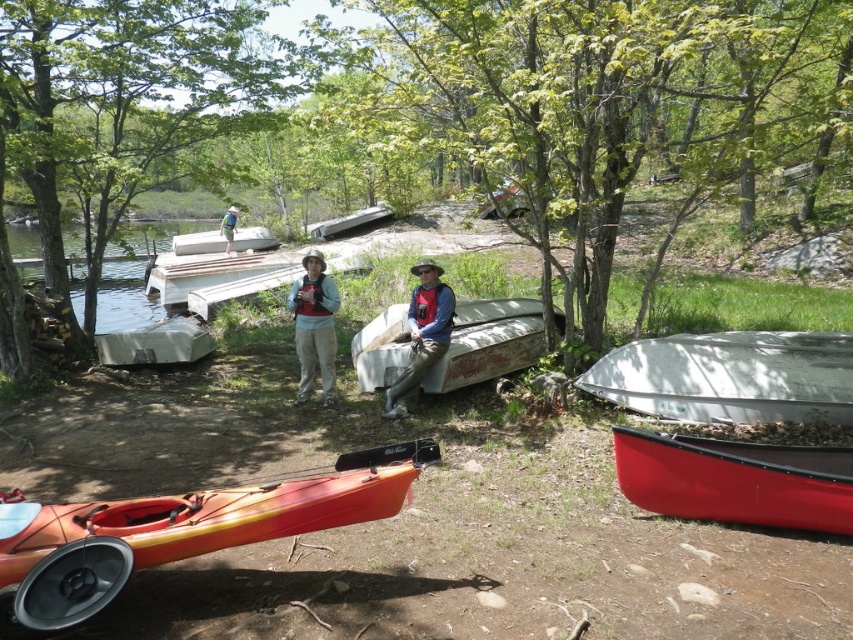
You are planning to carry the orange matte kayak at lower left and the white metallic boat at lower right to a storage shed. Which one is easier to carry because it is narrower?

The orange matte kayak at lower left is easier to carry because its width is less than the white metallic boat at lower right.

You are standing at the lakeside and want to retrieve your matte gray life vest at center before getting into the white metallic boat at lower right. Which item should you reach for first?

You should reach for the white metallic boat at lower right first because it is closer to you than the matte gray life vest at center.

You are standing at the point with coordinates point (x=730, y=376) in the image. What object are you standing on?

You are standing on the white metallic boat at lower right.